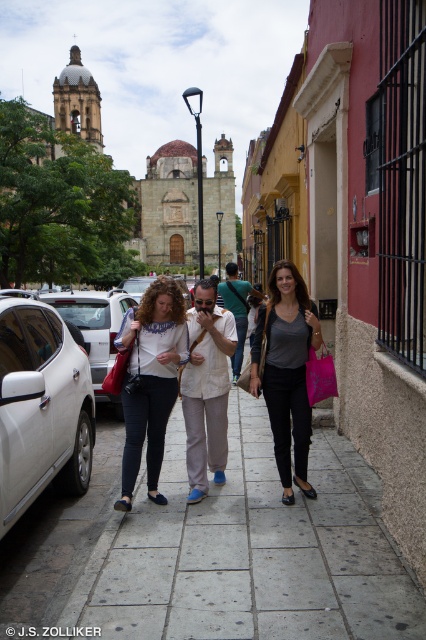
You are standing on the sidewalk in the historic area and want to take a photo of both the point at coordinates point [176,468] and the point at coordinates point [275,456]. Since you can only focus on one at a time, which point should you focus on first to ensure it appears closer in the photo?

You should focus on point [176,468] first because it is closer to you than point [275,456], so it will appear closer in the photo.

You are standing at the center of the street and see the white glossy car at lower left and the matte gray shirt at center. Which object is closer to you?

The matte gray shirt at center is closer to you since it is at the center of the scene, while the white glossy car at lower left is positioned further away at 25.38 meters.

You are standing on the street and want to take a photo of the point at coordinates point (316, 568). If your camera can focus up to 60 meters, will you need to adjust the focus to capture it clearly?

The distance of point (316, 568) from viewer is 61.98 meters, which is beyond the camera focus limit of 60 meters. You will need to adjust the focus to capture it clearly.